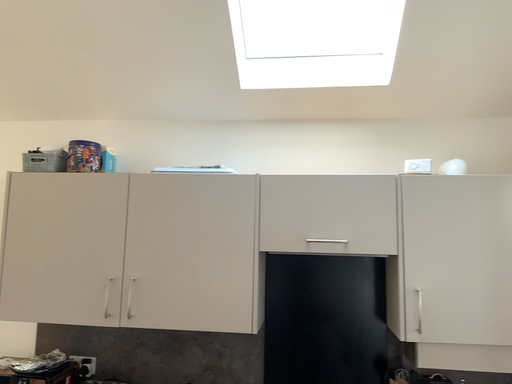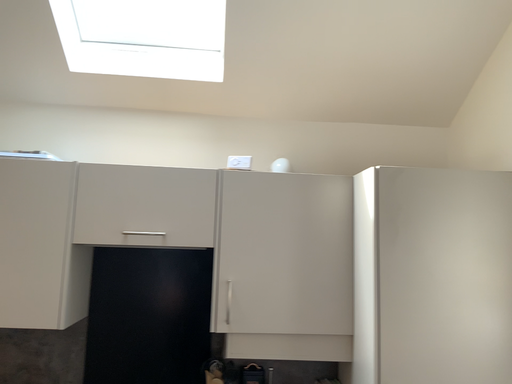
Question: Which way did the camera rotate in the video?

Choices:
 (A) rotated right
 (B) rotated left

Answer: (A)